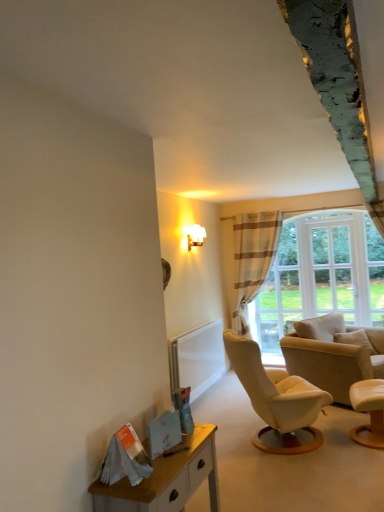
This screenshot has height=512, width=384. I want to click on vacant area situated below smooth beige armchair at lower right, placed as the 2th chair when sorted from back to front (from a real-world perspective), so click(369, 439).